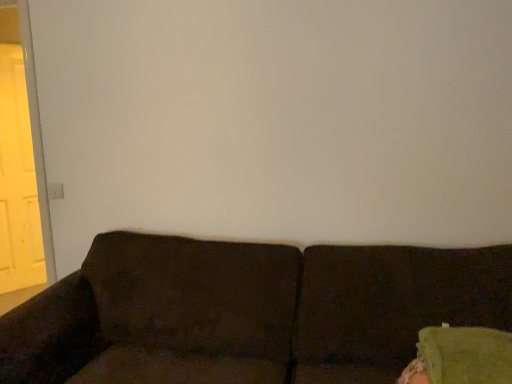
Question: Is yellow matte door at left not near dark brown fabric couch at lower center?

Choices:
 (A) yes
 (B) no

Answer: (A)

Question: Does yellow matte door at left appear on the left side of dark brown fabric couch at lower center?

Choices:
 (A) no
 (B) yes

Answer: (B)

Question: Is yellow matte door at left facing towards dark brown fabric couch at lower center?

Choices:
 (A) yes
 (B) no

Answer: (A)

Question: Considering the relative sizes of yellow matte door at left and dark brown fabric couch at lower center in the image provided, is yellow matte door at left bigger than dark brown fabric couch at lower center?

Choices:
 (A) no
 (B) yes

Answer: (A)

Question: Is dark brown fabric couch at lower center at the back of yellow matte door at left?

Choices:
 (A) no
 (B) yes

Answer: (A)

Question: Is yellow matte door at left located outside dark brown fabric couch at lower center?

Choices:
 (A) no
 (B) yes

Answer: (B)

Question: From a real-world perspective, is dark brown fabric couch at lower center on yellow matte door at left?

Choices:
 (A) no
 (B) yes

Answer: (A)

Question: Is dark brown fabric couch at lower center closer to the viewer compared to yellow matte door at left?

Choices:
 (A) yes
 (B) no

Answer: (A)

Question: Is dark brown fabric couch at lower center outside yellow matte door at left?

Choices:
 (A) no
 (B) yes

Answer: (B)

Question: Considering the relative positions of dark brown fabric couch at lower center and yellow matte door at left in the image provided, is dark brown fabric couch at lower center to the right of yellow matte door at left from the viewer's perspective?

Choices:
 (A) no
 (B) yes

Answer: (B)

Question: From the image's perspective, is dark brown fabric couch at lower center beneath yellow matte door at left?

Choices:
 (A) no
 (B) yes

Answer: (B)

Question: Considering the relative sizes of dark brown fabric couch at lower center and yellow matte door at left in the image provided, is dark brown fabric couch at lower center bigger than yellow matte door at left?

Choices:
 (A) no
 (B) yes

Answer: (B)

Question: From the image's perspective, is dark brown fabric couch at lower center above or below yellow matte door at left?

Choices:
 (A) below
 (B) above

Answer: (A)